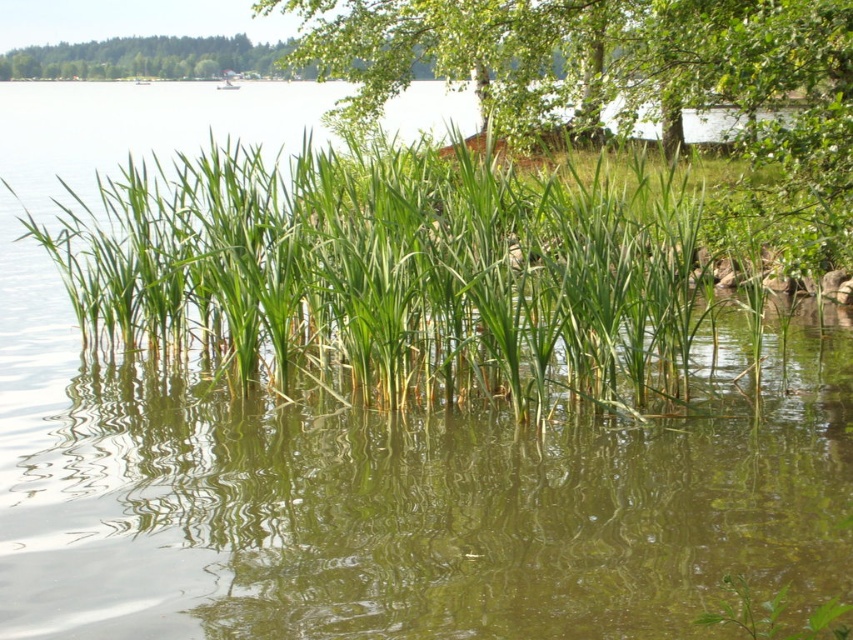
Describe the element at coordinates (397, 273) in the screenshot. I see `green grassy reed at center` at that location.

Between point (408, 284) and point (776, 148), which one is positioned behind?

Positioned behind is point (776, 148).

Locate an element on the screen. This screenshot has width=853, height=640. green grassy reed at center is located at coordinates (397, 273).